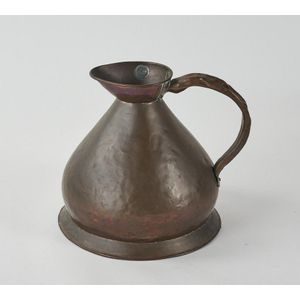
I want to click on jug, so click(183, 189).